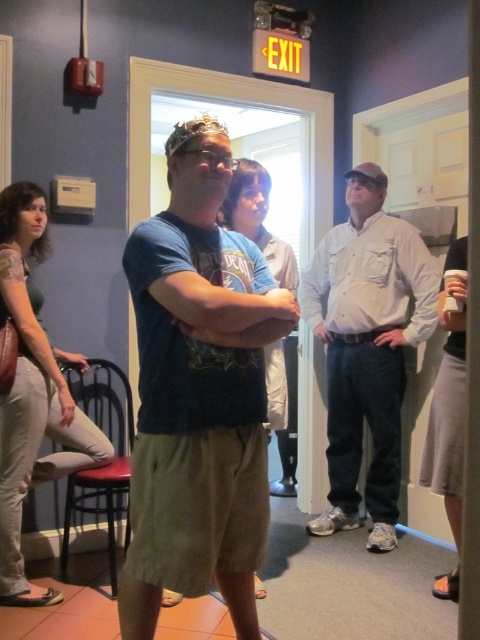
Question: Is matte blue t-shirt at center in front of light beige shirt at center?

Choices:
 (A) yes
 (B) no

Answer: (A)

Question: Does light beige shirt at center come in front of gold metallic tiara at center?

Choices:
 (A) yes
 (B) no

Answer: (B)

Question: Which of the following is the closest to the observer?

Choices:
 (A) red cushioned stool at lower left
 (B) gold metallic tiara at center
 (C) matte green shirt at center

Answer: (B)

Question: Is the position of matte green shirt at center more distant than that of red cushioned stool at lower left?

Choices:
 (A) yes
 (B) no

Answer: (B)

Question: Which point is farther from the camera taking this photo?

Choices:
 (A) (213, 369)
 (B) (126, 513)
 (C) (393, 228)

Answer: (C)

Question: Among these objects, which one is farthest from the camera?

Choices:
 (A) matte blue t-shirt at center
 (B) gold metallic tiara at center

Answer: (B)